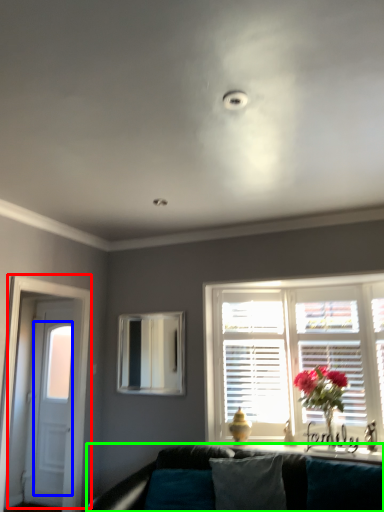
Question: Based on their relative distances, which object is farther from door (highlighted by a red box)? Choose from glass door (highlighted by a blue box) and studio couch (highlighted by a green box).

Choices:
 (A) glass door
 (B) studio couch

Answer: (B)